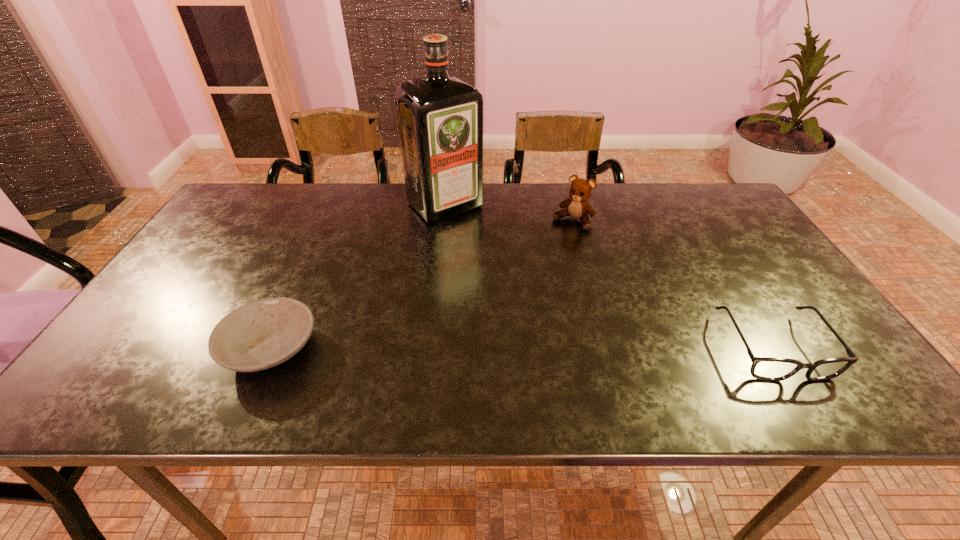
I want to click on the leftmost object, so click(x=262, y=334).

I want to click on the rightmost object, so click(x=763, y=368).

I want to click on liquor, so click(x=440, y=118).

Where is `the third object from right to left`? The image size is (960, 540). the third object from right to left is located at coordinates (440, 118).

Identify the location of the second object from right to left. Image resolution: width=960 pixels, height=540 pixels. (577, 206).

Where is `teddy bear`? teddy bear is located at coordinates (577, 206).

Identify the location of vacant area situated on the right of the bowl. This screenshot has height=540, width=960. (500, 348).

Find the location of a particular element. The width and height of the screenshot is (960, 540). vacant position located 0.370m on the front label of the second object from left to right is located at coordinates (541, 295).

Locate an element on the screen. This screenshot has width=960, height=540. free space located 0.060m on the front label of the second object from left to right is located at coordinates (475, 232).

Where is `vacant space situated 0.190m on the front label of the second object from left to right`? Image resolution: width=960 pixels, height=540 pixels. vacant space situated 0.190m on the front label of the second object from left to right is located at coordinates (500, 256).